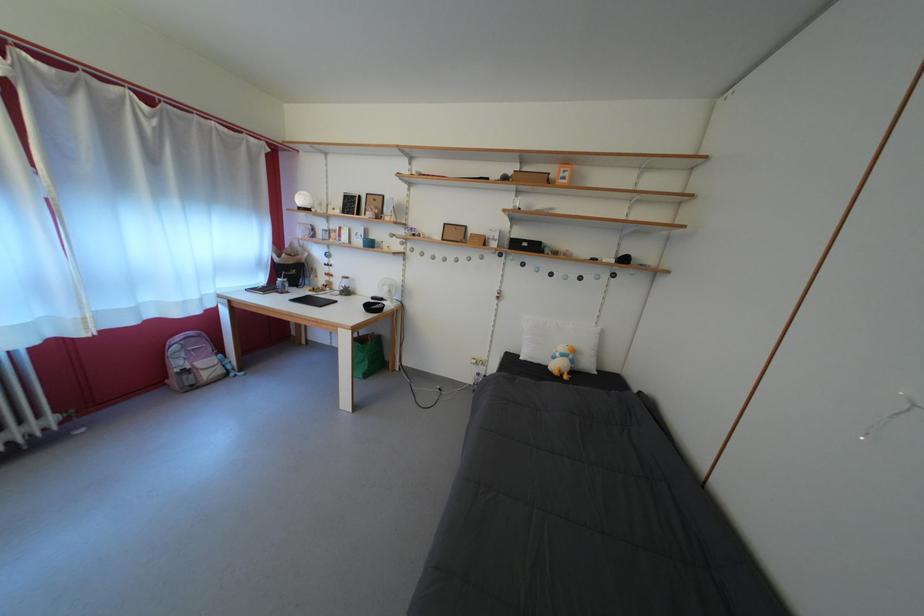
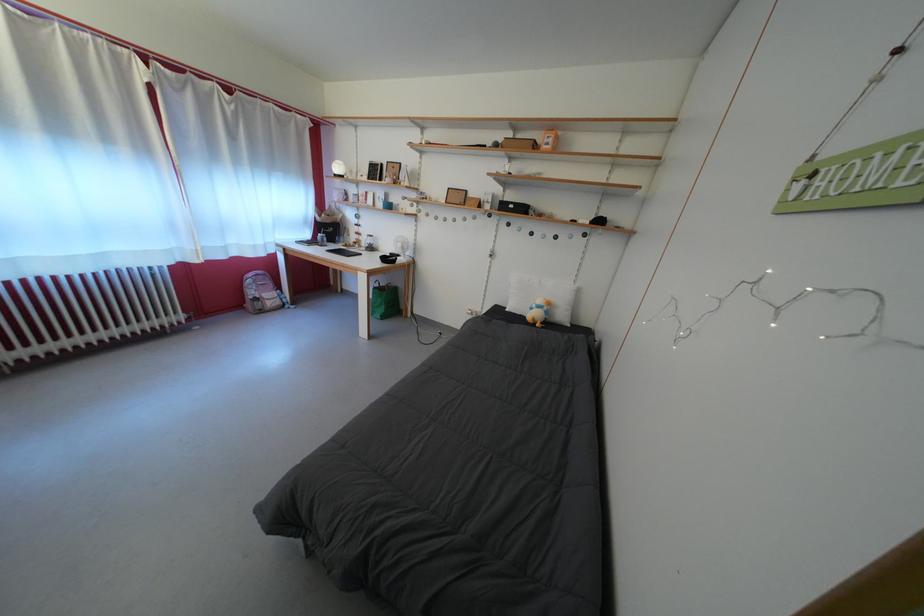
Where in the second image is the point corresponding to pixel 362 346 from the first image?

(383, 294)